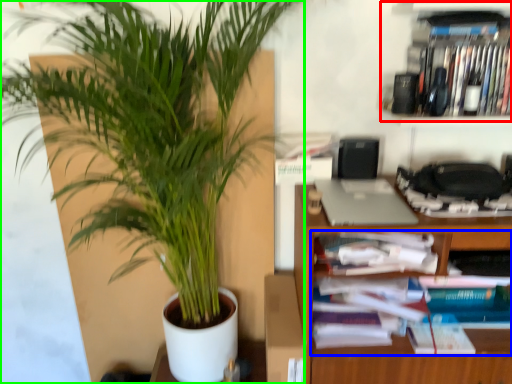
Question: Which object is positioned closest to cabinet (highlighted by a red box)? Select from book (highlighted by a blue box) and houseplant (highlighted by a green box).

Choices:
 (A) book
 (B) houseplant

Answer: (A)